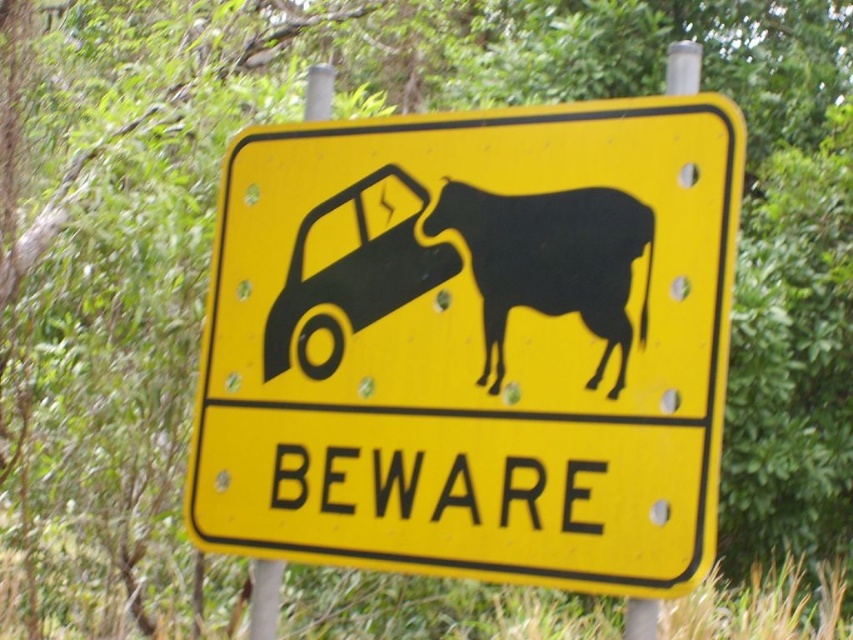
Question: Which point appears farthest from the camera in this image?

Choices:
 (A) (495, 348)
 (B) (593, 378)

Answer: (A)

Question: Can you confirm if yellow matte sign at center is positioned to the right of black matte car at left?

Choices:
 (A) yes
 (B) no

Answer: (A)

Question: Estimate the real-world distances between objects in this image. Which object is farther from the black matte bull at center?

Choices:
 (A) black matte car at left
 (B) yellow matte sign at center

Answer: (A)

Question: Does yellow matte sign at center appear under black matte bull at center?

Choices:
 (A) no
 (B) yes

Answer: (B)

Question: Can you confirm if yellow matte sign at center is thinner than black matte bull at center?

Choices:
 (A) no
 (B) yes

Answer: (A)

Question: Which point is farther to the camera?

Choices:
 (A) yellow matte sign at center
 (B) black matte car at left

Answer: (B)